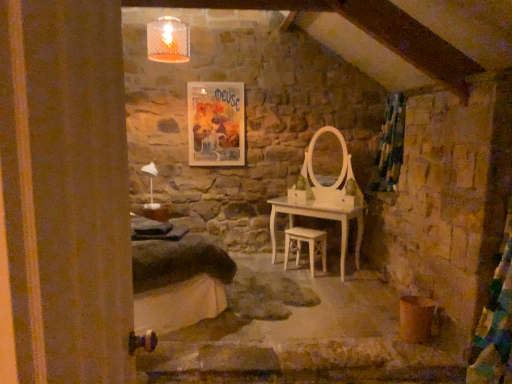
Question: From the image's perspective, is white glossy table lamp at left positioned above or below matte paper poster at upper center?

Choices:
 (A) above
 (B) below

Answer: (B)

Question: From a real-world perspective, is white glossy table lamp at left positioned above or below matte paper poster at upper center?

Choices:
 (A) above
 (B) below

Answer: (B)

Question: Which object is the closest to the matte paper poster at upper center?

Choices:
 (A) white wooden stool at center
 (B) green fabric curtain at right
 (C) white glossy table lamp at left

Answer: (C)

Question: Which is nearer to the white wooden stool at center?

Choices:
 (A) white glossy table lamp at left
 (B) matte paper poster at upper center
 (C) green fabric curtain at right

Answer: (C)